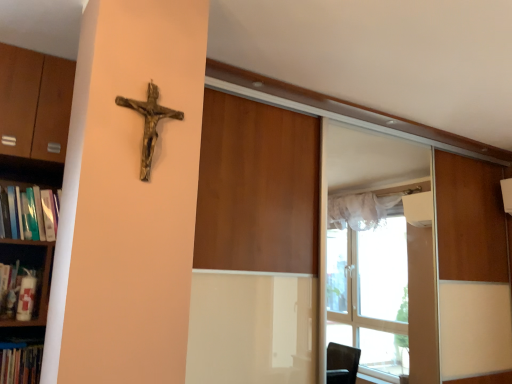
Question: Can you confirm if wooden crucifix at upper left is shorter than hardcover book at left?

Choices:
 (A) no
 (B) yes

Answer: (A)

Question: Does wooden crucifix at upper left have a greater height compared to hardcover book at left?

Choices:
 (A) no
 (B) yes

Answer: (B)

Question: Does wooden crucifix at upper left lie behind hardcover book at left?

Choices:
 (A) no
 (B) yes

Answer: (A)

Question: Is wooden crucifix at upper left wider than hardcover book at left?

Choices:
 (A) yes
 (B) no

Answer: (B)

Question: Considering the relative sizes of wooden crucifix at upper left and hardcover book at left in the image provided, is wooden crucifix at upper left smaller than hardcover book at left?

Choices:
 (A) yes
 (B) no

Answer: (A)

Question: Does point (38, 311) appear closer or farther from the camera than point (19, 130)?

Choices:
 (A) closer
 (B) farther

Answer: (A)

Question: Considering their positions, is white matte shelf at left, which appears as the 1th shelf when ordered from the bottom, located in front of or behind wooden bookshelf at left, acting as the 1th shelf starting from the top?

Choices:
 (A) front
 (B) behind

Answer: (B)

Question: Considering the relative positions of white matte shelf at left, which appears as the 1th shelf when ordered from the bottom, and wooden bookshelf at left, which is counted as the 2th shelf, starting from the bottom, in the image provided, is white matte shelf at left, which appears as the 1th shelf when ordered from the bottom, to the left or to the right of wooden bookshelf at left, which is counted as the 2th shelf, starting from the bottom,?

Choices:
 (A) right
 (B) left

Answer: (B)

Question: Is white matte shelf at left, the second shelf viewed from the top, spatially inside wooden bookshelf at left, acting as the 1th shelf starting from the top, or outside of it?

Choices:
 (A) inside
 (B) outside

Answer: (A)

Question: Would you say wooden bookshelf at left, which is counted as the 2th shelf, starting from the bottom, is to the left or to the right of wooden crucifix at upper left in the picture?

Choices:
 (A) right
 (B) left

Answer: (B)

Question: Is wooden bookshelf at left, which is counted as the 2th shelf, starting from the bottom, inside or outside of wooden crucifix at upper left?

Choices:
 (A) outside
 (B) inside

Answer: (A)

Question: Is wooden bookshelf at left, acting as the 1th shelf starting from the top, in front of or behind wooden crucifix at upper left in the image?

Choices:
 (A) front
 (B) behind

Answer: (B)

Question: From a real-world perspective, relative to wooden crucifix at upper left, is wooden bookshelf at left, acting as the 1th shelf starting from the top, vertically above or below?

Choices:
 (A) below
 (B) above

Answer: (A)

Question: From a real-world perspective, is hardcover book at left positioned above or below wooden crucifix at upper left?

Choices:
 (A) above
 (B) below

Answer: (B)

Question: Is point (26, 210) positioned closer to the camera than point (153, 109)?

Choices:
 (A) closer
 (B) farther

Answer: (B)